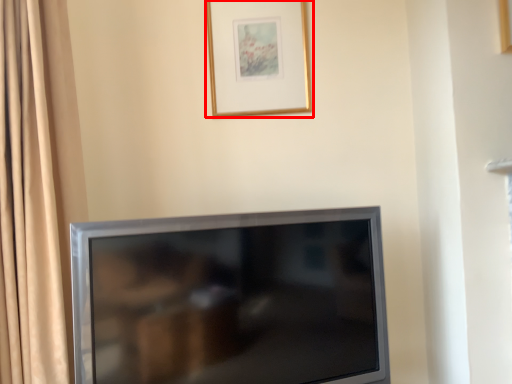
Question: From the image's perspective, considering the relative positions of picture frame (annotated by the red box) and television in the image provided, where is picture frame (annotated by the red box) located with respect to the staircase?

Choices:
 (A) above
 (B) below

Answer: (A)